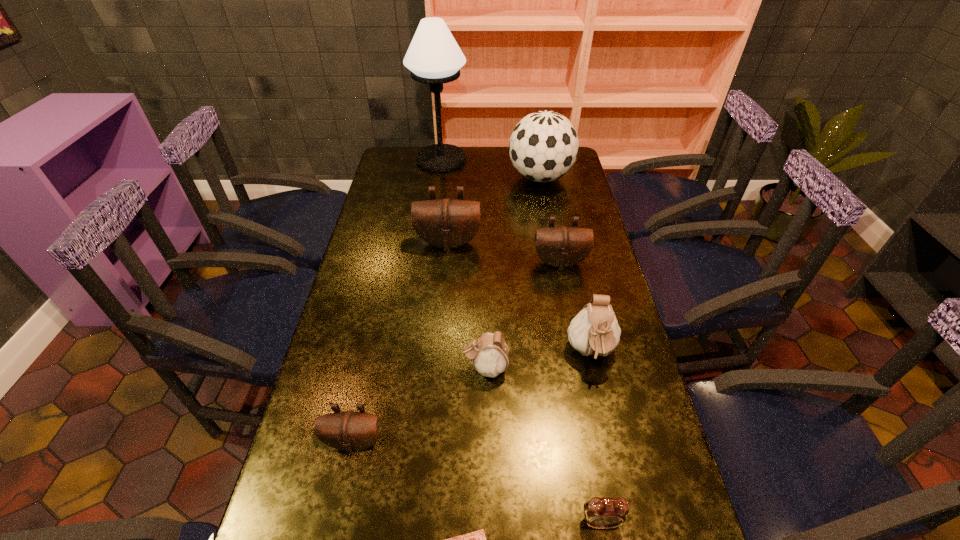
The height and width of the screenshot is (540, 960). In order to click on the tallest object in this screenshot , I will do `click(433, 57)`.

You are a GUI agent. You are given a task and a screenshot of the screen. Output one action in this format:
    pyautogui.click(x=<x>, y=<y>)
    Task: Click on the black table lamp
    Image resolution: width=960 pixels, height=540 pixels.
    Given the screenshot: What is the action you would take?
    pyautogui.click(x=433, y=57)

Find the location of a particular element. black soccer ball is located at coordinates (543, 147).

I want to click on soccer ball, so click(543, 147).

I want to click on the biggest brown pouch, so click(446, 223).

Where is `the right white pouch`? The height and width of the screenshot is (540, 960). the right white pouch is located at coordinates (594, 330).

Locate an element on the screen. Image resolution: width=960 pixels, height=540 pixels. the second biggest brown pouch is located at coordinates (562, 246).

This screenshot has height=540, width=960. Identify the location of the left white pouch. (489, 353).

This screenshot has width=960, height=540. What are the coordinates of `the nearest brown pouch` in the screenshot? It's located at (349, 431).

Image resolution: width=960 pixels, height=540 pixels. What are the coordinates of `the third nearest object` in the screenshot? It's located at (349, 431).